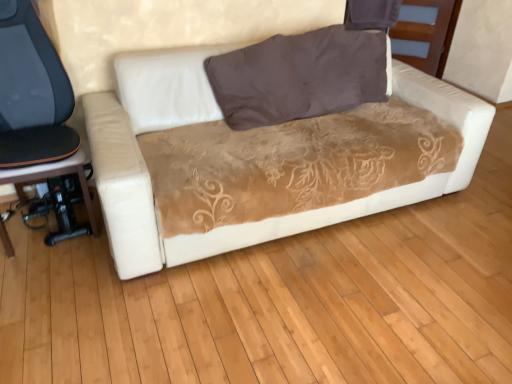
Question: Is velvet brown couch at center looking in the opposite direction of brown velvety pillow at upper center?

Choices:
 (A) no
 (B) yes

Answer: (B)

Question: Can you confirm if velvet brown couch at center is shorter than brown velvety pillow at upper center?

Choices:
 (A) yes
 (B) no

Answer: (B)

Question: Is velvet brown couch at center bigger than brown velvety pillow at upper center?

Choices:
 (A) no
 (B) yes

Answer: (B)

Question: Is velvet brown couch at center oriented towards brown velvety pillow at upper center?

Choices:
 (A) no
 (B) yes

Answer: (A)

Question: Does velvet brown couch at center have a lesser width compared to brown velvety pillow at upper center?

Choices:
 (A) no
 (B) yes

Answer: (A)

Question: From the image's perspective, relative to velvet brown couch at center, is black leather chair at left above or below?

Choices:
 (A) below
 (B) above

Answer: (A)

Question: Visually, is black leather chair at left positioned to the left or to the right of velvet brown couch at center?

Choices:
 (A) left
 (B) right

Answer: (A)

Question: Is point (74, 162) positioned closer to the camera than point (99, 119)?

Choices:
 (A) closer
 (B) farther

Answer: (A)

Question: From a real-world perspective, is black leather chair at left positioned above or below velvet brown couch at center?

Choices:
 (A) above
 (B) below

Answer: (A)

Question: From their relative heights in the image, would you say black leather chair at left is taller or shorter than black plastic music stool at lower left?

Choices:
 (A) short
 (B) tall

Answer: (B)

Question: In the image, is black leather chair at left positioned in front of or behind black plastic music stool at lower left?

Choices:
 (A) front
 (B) behind

Answer: (A)

Question: From the image's perspective, is black leather chair at left located above or below black plastic music stool at lower left?

Choices:
 (A) above
 (B) below

Answer: (A)

Question: Looking at the image, does black leather chair at left seem bigger or smaller compared to black plastic music stool at lower left?

Choices:
 (A) big
 (B) small

Answer: (A)

Question: Is black plastic music stool at lower left wider or thinner than brown velvety pillow at upper center?

Choices:
 (A) wide
 (B) thin

Answer: (A)

Question: Is black plastic music stool at lower left bigger or smaller than brown velvety pillow at upper center?

Choices:
 (A) big
 (B) small

Answer: (B)